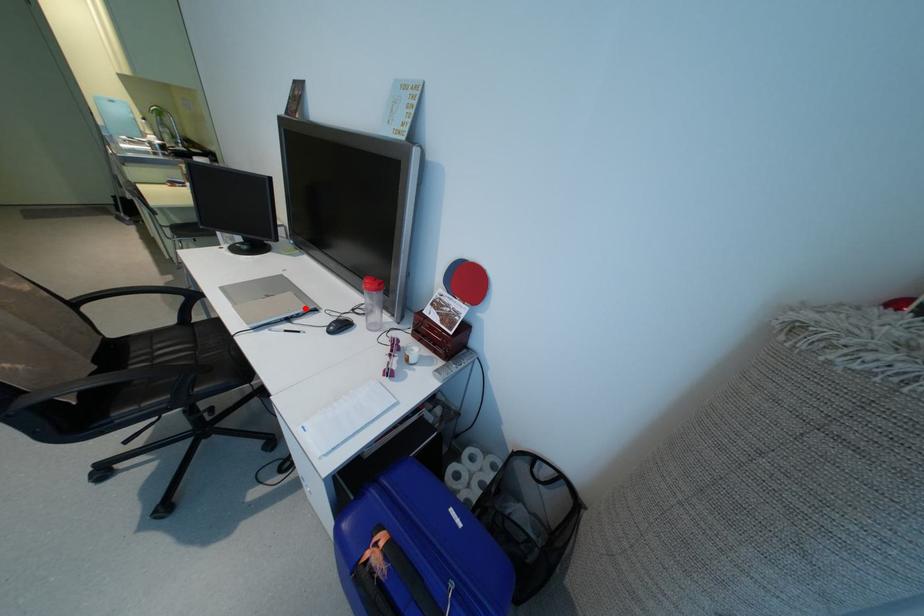
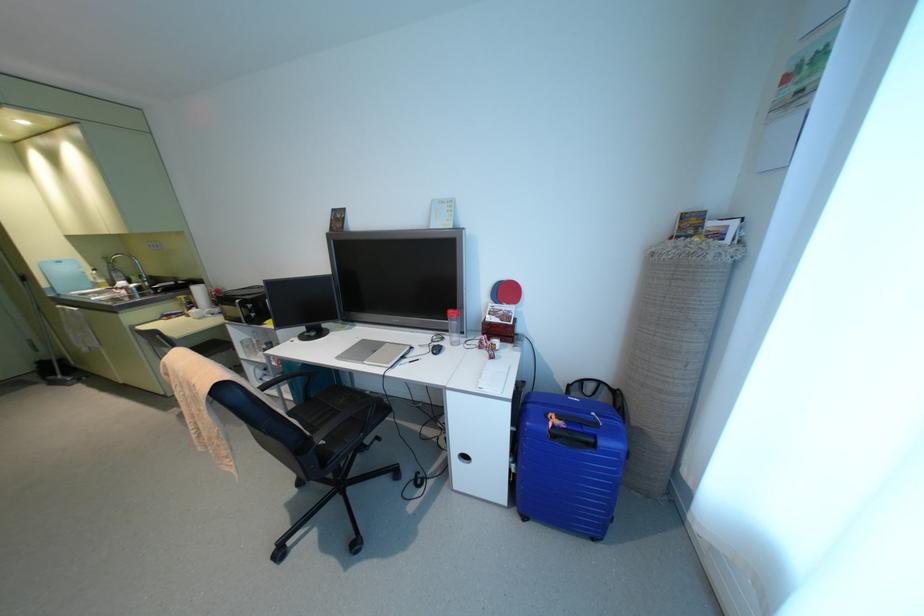
Locate, in the second image, the point that corresponds to the highlighted location in the first image.

(407, 347)